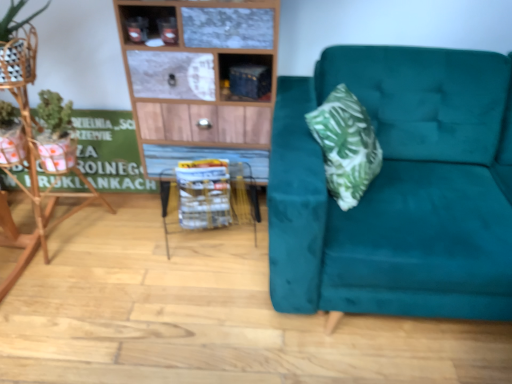
Where is `metallic blue cabinet at upper center`? metallic blue cabinet at upper center is located at coordinates (245, 77).

Measure the distance between point [477,269] and camera.

Point [477,269] and camera are 4.42 feet apart.

Locate an element on the screen. The image size is (512, 384). metallic blue cabinet at upper center is located at coordinates (245, 77).

Is metallic wireframe table at center at the left side of teal velvet couch at right?

Yes.

Between metallic wireframe table at center and teal velvet couch at right, which one has more height?

teal velvet couch at right is taller.

From the image's perspective, between metallic wireframe table at center and teal velvet couch at right, who is located below?

metallic wireframe table at center is shown below in the image.

Is metallic wireframe table at center oriented away from teal velvet couch at right?

No, teal velvet couch at right is not at the back of metallic wireframe table at center.

Which object is further away from the camera, white plastic basket at center or metallic blue cabinet at upper center?

white plastic basket at center.

From their relative heights in the image, would you say white plastic basket at center is taller or shorter than metallic blue cabinet at upper center?

In the image, white plastic basket at center appears to be taller than metallic blue cabinet at upper center.

Does point (207, 160) lie behind point (255, 54)?

Yes, it is behind point (255, 54).

Looking at this image, could you tell me if white plastic basket at center is turned towards metallic blue cabinet at upper center?

No, white plastic basket at center is not aimed at metallic blue cabinet at upper center.

Which is more to the right, metallic blue cabinet at upper center or white plastic basket at center?

Positioned to the right is metallic blue cabinet at upper center.

Considering the sizes of objects metallic blue cabinet at upper center and white plastic basket at center in the image provided, who is thinner, metallic blue cabinet at upper center or white plastic basket at center?

Thinner between the two is metallic blue cabinet at upper center.

From the image's perspective, which object appears higher, metallic blue cabinet at upper center or white plastic basket at center?

From the image's view, metallic blue cabinet at upper center is above.

Is metallic blue cabinet at upper center looking in the opposite direction of white plastic basket at center?

No, white plastic basket at center is not at the back of metallic blue cabinet at upper center.

How far apart are metallic blue cabinet at upper center and teal velvet couch at right?

metallic blue cabinet at upper center is 24.32 inches from teal velvet couch at right.

Which of these two, metallic blue cabinet at upper center or teal velvet couch at right, is smaller?

metallic blue cabinet at upper center is smaller.

In the scene shown: Is metallic blue cabinet at upper center taller or shorter than teal velvet couch at right?

metallic blue cabinet at upper center is shorter than teal velvet couch at right.

Considering the points (271, 67) and (289, 253), which point is in front, point (271, 67) or point (289, 253)?

Positioned in front is point (289, 253).

Is metallic blue cabinet at upper center at the back of teal velvet couch at right?

teal velvet couch at right does not have its back to metallic blue cabinet at upper center.

Image resolution: width=512 pixels, height=384 pixels. I want to click on studio couch that appears below the metallic blue cabinet at upper center (from a real-world perspective), so click(x=398, y=189).

Which object is closer to the camera taking this photo, teal velvet couch at right or metallic blue cabinet at upper center?

teal velvet couch at right is in front.

How much distance is there between metallic wireframe table at center and white plastic basket at center?

The distance of metallic wireframe table at center from white plastic basket at center is 4.22 centimeters.

Considering the relative positions of metallic wireframe table at center and white plastic basket at center in the image provided, is metallic wireframe table at center to the left or to the right of white plastic basket at center?

metallic wireframe table at center is to the right of white plastic basket at center.

How different are the orientations of metallic wireframe table at center and white plastic basket at center in degrees?

The angular difference between metallic wireframe table at center and white plastic basket at center is 0.00163 degrees.

Is metallic wireframe table at center in front of or behind white plastic basket at center in the image?

metallic wireframe table at center is in front of white plastic basket at center.

Is point (205, 219) closer to camera compared to point (178, 163)?

Yes.

Is metallic wireframe table at center at the back of white plastic basket at center?

Correct, white plastic basket at center is looking away from metallic wireframe table at center.

Would you consider white plastic basket at center to be distant from metallic wireframe table at center?

No, there isn't a large distance between white plastic basket at center and metallic wireframe table at center.

Identify the location of studio couch positioned vertically above the metallic wireframe table at center (from a real-world perspective). This screenshot has width=512, height=384. (398, 189).

The width and height of the screenshot is (512, 384). In order to click on cabinet that appears in front of the white plastic basket at center in this screenshot , I will do `click(245, 77)`.

When comparing their distances from metallic blue cabinet at upper center, does teal velvet couch at right or metallic wireframe table at center seem closer?

Among the two, metallic wireframe table at center is located nearer to metallic blue cabinet at upper center.

Estimate the real-world distances between objects in this image. Which object is further from teal velvet couch at right, metallic blue cabinet at upper center or white plastic basket at center?

white plastic basket at center is positioned further to the anchor teal velvet couch at right.

When comparing their distances from metallic wireframe table at center, does metallic blue cabinet at upper center or white plastic basket at center seem closer?

Based on the image, white plastic basket at center appears to be nearer to metallic wireframe table at center.

Based on their spatial positions, is metallic wireframe table at center or white plastic basket at center further from metallic blue cabinet at upper center?

metallic wireframe table at center.

Based on their spatial positions, is metallic blue cabinet at upper center or metallic wireframe table at center further from white plastic basket at center?

metallic blue cabinet at upper center.

When comparing their distances from metallic blue cabinet at upper center, does white plastic basket at center or metallic wireframe table at center seem closer?

Based on the image, white plastic basket at center appears to be nearer to metallic blue cabinet at upper center.

Which object lies nearer to the anchor point metallic blue cabinet at upper center, white plastic basket at center or teal velvet couch at right?

The object closer to metallic blue cabinet at upper center is white plastic basket at center.

From the picture: When comparing their distances from metallic wireframe table at center, does metallic blue cabinet at upper center or teal velvet couch at right seem closer?

metallic blue cabinet at upper center is positioned closer to the anchor metallic wireframe table at center.

You are a GUI agent. You are given a task and a screenshot of the screen. Output one action in this format:
    pyautogui.click(x=<x>, y=<y>)
    Task: Click on the table located between white plastic basket at center and teal velvet couch at right in the left-right direction
    The height and width of the screenshot is (384, 512).
    Given the screenshot: What is the action you would take?
    pyautogui.click(x=210, y=195)

In order to click on basket between metallic blue cabinet at upper center and metallic wireframe table at center from top to bottom in this screenshot , I will do `click(204, 193)`.

What are the coordinates of `cabinet situated between metallic wireframe table at center and teal velvet couch at right from left to right` in the screenshot? It's located at (245, 77).

The image size is (512, 384). I want to click on cabinet between white plastic basket at center and teal velvet couch at right, so click(x=245, y=77).